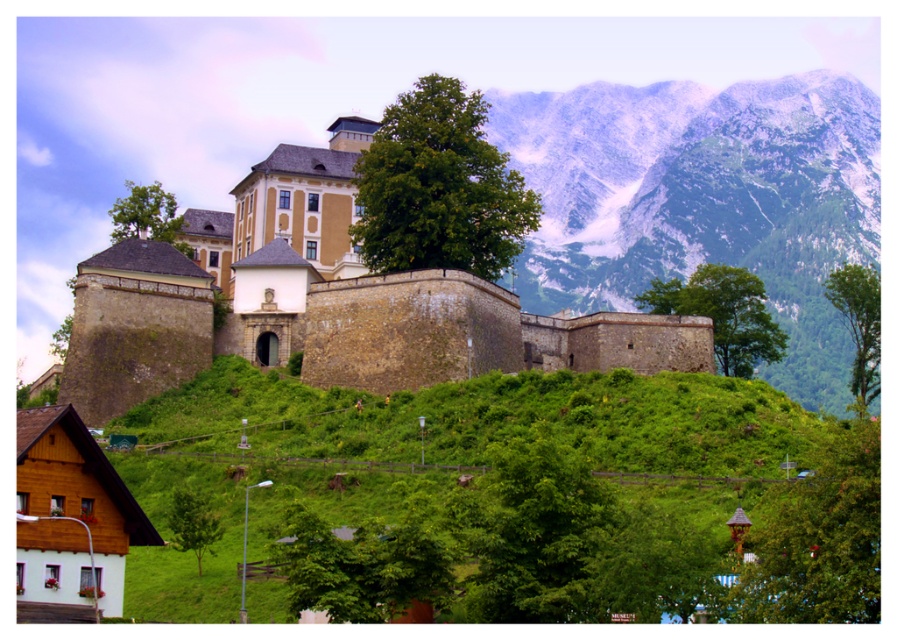
What do you see at coordinates (817, 540) in the screenshot?
I see `green leafy tree at lower right` at bounding box center [817, 540].

You are a GUI agent. You are given a task and a screenshot of the screen. Output one action in this format:
    pyautogui.click(x=<x>, y=<y>)
    Task: Click on the green leafy tree at lower right
    
    Given the screenshot: What is the action you would take?
    pyautogui.click(x=817, y=540)

Which is in front, point (512, 177) or point (855, 340)?

Point (512, 177) is more forward.

Locate an element on the screen. green leafy tree at center is located at coordinates (440, 188).

Between point (739, 308) and point (210, 540), which one is positioned in front?

Point (210, 540)

Find the location of `green leafy tree at upper right`. green leafy tree at upper right is located at coordinates (723, 314).

Between point (736, 369) and point (210, 524), which one is positioned behind?

Positioned behind is point (736, 369).

The width and height of the screenshot is (897, 640). In order to click on green leafy tree at upper right in this screenshot , I will do `click(723, 314)`.